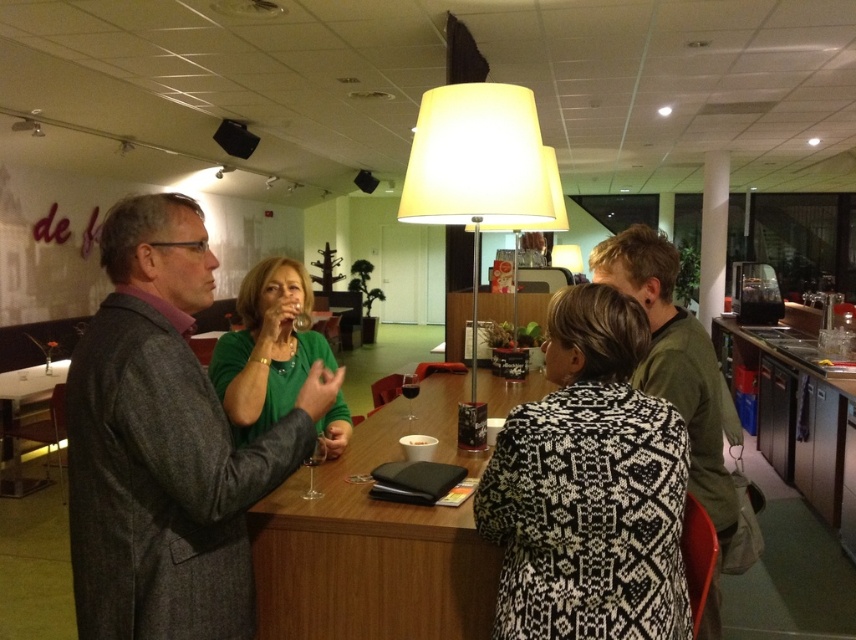
What do you see at coordinates (589, 486) in the screenshot? This screenshot has width=856, height=640. I see `black and white knitted sweater at center` at bounding box center [589, 486].

I want to click on black and white knitted sweater at center, so click(x=589, y=486).

Between point (492, 595) and point (670, 346), which one is positioned in front?

Point (492, 595) is more forward.

Which is behind, point (474, 611) or point (706, 365)?

The point (706, 365) is more distant.

The height and width of the screenshot is (640, 856). In order to click on wooden table at center in this screenshot , I will do `click(367, 556)`.

Who is higher up, green cotton shirt at center or green matte shirt at center?

green matte shirt at center

Does point (623, 250) come in front of point (324, 339)?

Yes, it is in front of point (324, 339).

Which is behind, point (697, 436) or point (247, 442)?

Positioned behind is point (247, 442).

In order to click on green cotton shirt at center in this screenshot , I will do `click(679, 378)`.